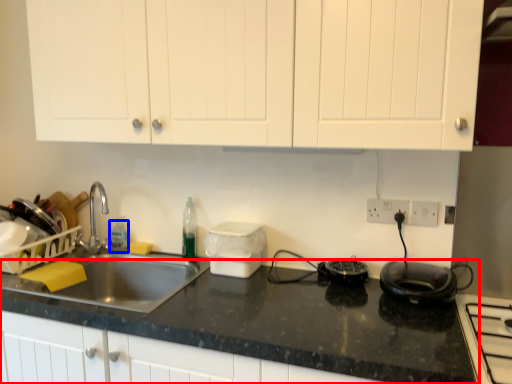
Question: Which of the following is the closest to the observer, countertop (highlighted by a red box) or bottle (highlighted by a blue box)?

Choices:
 (A) countertop
 (B) bottle

Answer: (A)